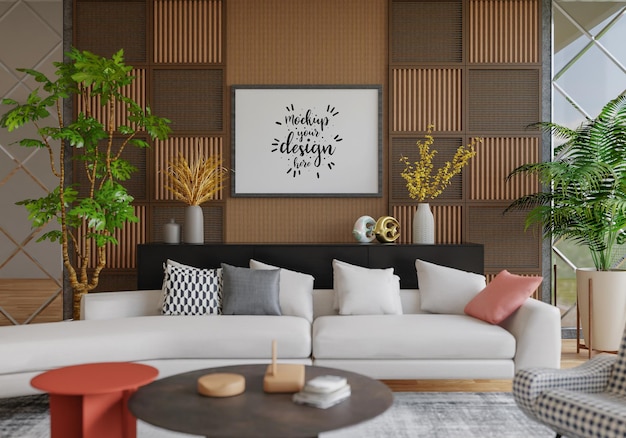
Locate an element on the screen. This screenshot has width=626, height=438. mirrored wall is located at coordinates (598, 75).